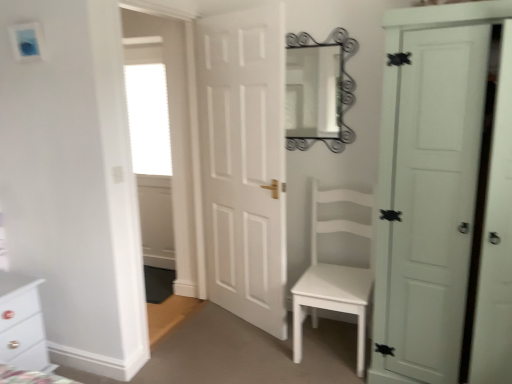
Question: In the image, is white matte door at right, the 1th door positioned from the right, on the left side or the right side of white matte door at center, which appears as the second door when viewed from the right?

Choices:
 (A) left
 (B) right

Answer: (B)

Question: From their relative heights in the image, would you say white matte door at right, the 2th door from the left, is taller or shorter than white matte door at center, which appears as the second door when viewed from the right?

Choices:
 (A) short
 (B) tall

Answer: (A)

Question: Which object is positioned farthest from the white matte chair at center?

Choices:
 (A) metallic silver mirror at upper center
 (B) white matte door at right, the 1th door positioned from the right
 (C) white matte door at center, the 1th door in the left-to-right sequence
 (D) white frosted glass window at upper left
 (E) white glossy chest of drawers at lower left

Answer: (D)

Question: Considering the real-world distances, which object is farthest from the white glossy chest of drawers at lower left?

Choices:
 (A) metallic silver mirror at upper center
 (B) white matte door at right, the 2th door from the left
 (C) white matte door at center, which appears as the second door when viewed from the right
 (D) white matte chair at center
 (E) white frosted glass window at upper left

Answer: (A)